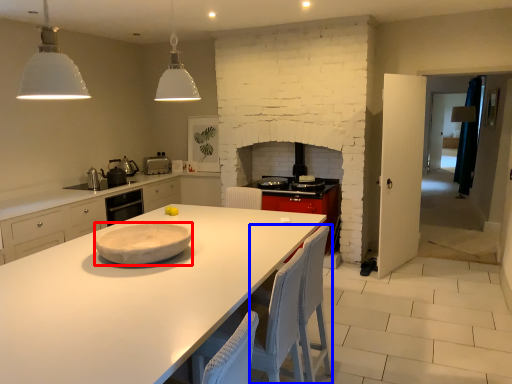
Question: Which object is further to the camera taking this photo, platter (highlighted by a red box) or chair (highlighted by a blue box)?

Choices:
 (A) platter
 (B) chair

Answer: (B)